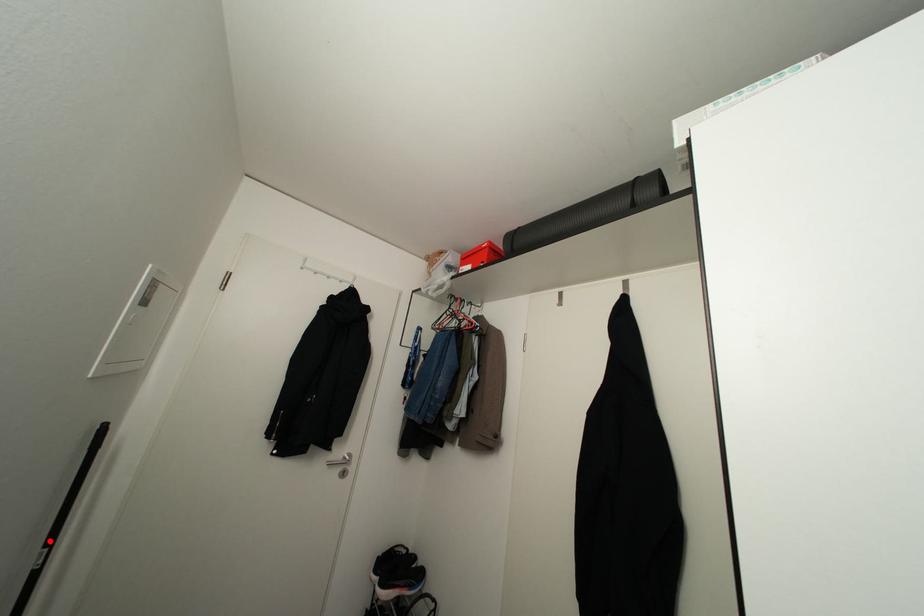
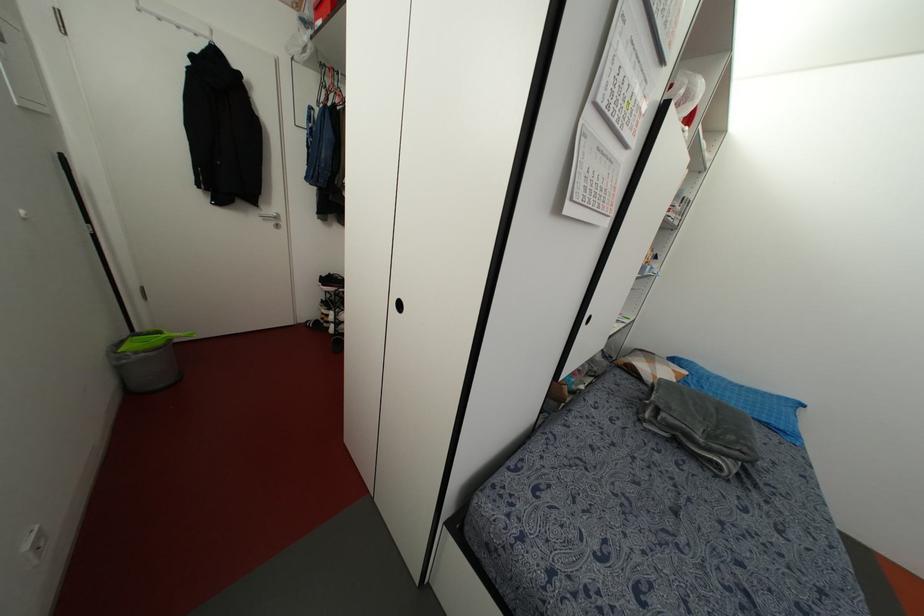
Question: A red point is marked in image1. In image2, is the corresponding 3D point closer to the camera or farther? Reply with the corresponding letter.

Choices:
 (A) The corresponding 3D point is closer.
 (B) The corresponding 3D point is farther.

Answer: (A)